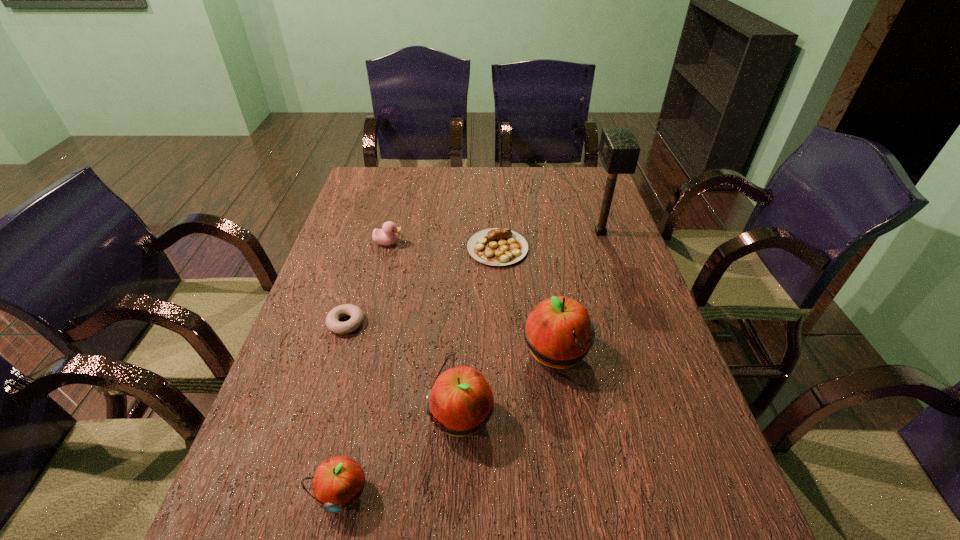
At what (x,y) coordinates should I click in order to perform the action: click on doughnut located at the left edge. Please return your answer as a coordinate pair (x, y). The image size is (960, 540). Looking at the image, I should click on (333, 324).

Identify the location of object present at the right edge. The width and height of the screenshot is (960, 540). [619, 150].

The image size is (960, 540). In order to click on object present at the near left corner in this screenshot , I will do `click(338, 482)`.

The image size is (960, 540). In order to click on vacant space at the far edge in this screenshot , I will do `click(426, 186)`.

You are a GUI agent. You are given a task and a screenshot of the screen. Output one action in this format:
    pyautogui.click(x=<x>, y=<y>)
    Task: Click on the vacant space at the near edge of the desktop
    
    Given the screenshot: What is the action you would take?
    click(393, 491)

Identify the location of vacant space at the left edge of the desktop. This screenshot has height=540, width=960. point(378,218).

Identify the location of vacant region at the right edge of the desktop. This screenshot has height=540, width=960. (672, 364).

In the image, there is a desktop. Where is `free space at the far left corner`? The width and height of the screenshot is (960, 540). free space at the far left corner is located at coordinates (363, 186).

At what (x,y) coordinates should I click in order to perform the action: click on free space between the rightmost apple and the second tallest apple. Please return your answer as a coordinate pair (x, y). Looking at the image, I should click on (509, 386).

I want to click on unoccupied area between the mallet and the shortest object, so click(x=473, y=278).